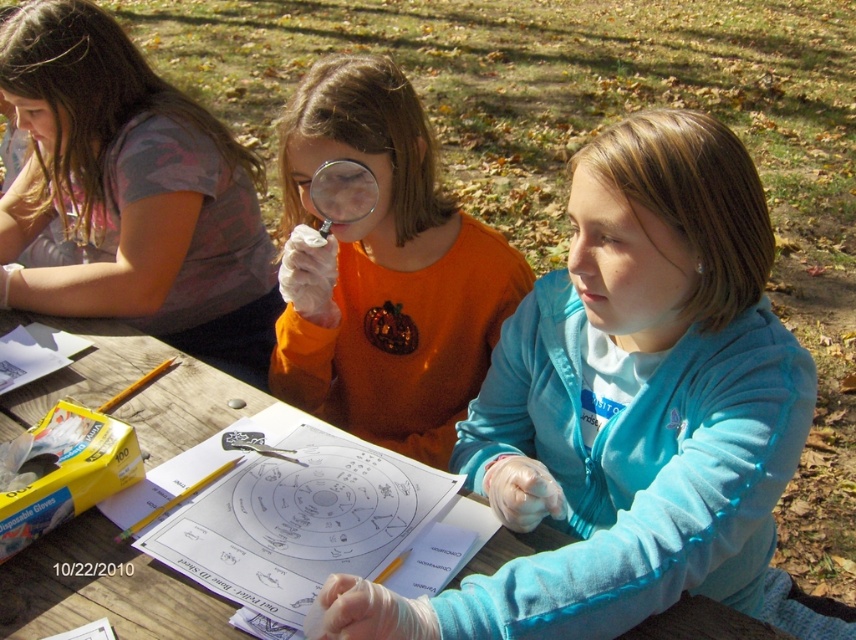
Question: Does orange sequined shirt at center appear on the left side of camouflage fabric shirt at upper left?

Choices:
 (A) no
 (B) yes

Answer: (A)

Question: Which of the following is the farthest from the observer?

Choices:
 (A) camouflage fabric shirt at upper left
 (B) wooden table at center
 (C) orange sequined shirt at center

Answer: (A)

Question: Does blue fleece jacket at center appear over camouflage fabric shirt at upper left?

Choices:
 (A) no
 (B) yes

Answer: (A)

Question: Is blue fleece jacket at center behind camouflage fabric shirt at upper left?

Choices:
 (A) yes
 (B) no

Answer: (B)

Question: Which point appears farthest from the camera in this image?

Choices:
 (A) (355, 170)
 (B) (60, 326)
 (C) (664, 545)

Answer: (B)

Question: Which of these objects is positioned closest to the transparent plastic magnifying glass at center?

Choices:
 (A) camouflage fabric shirt at upper left
 (B) blue fleece jacket at center
 (C) orange sequined shirt at center

Answer: (C)